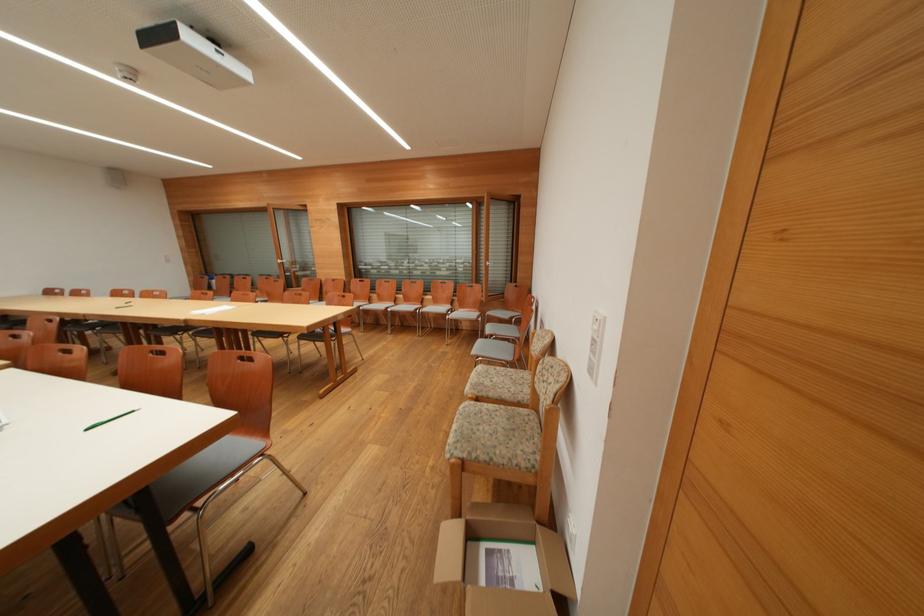
Where is `white switch button`? Image resolution: width=924 pixels, height=616 pixels. white switch button is located at coordinates (594, 345).